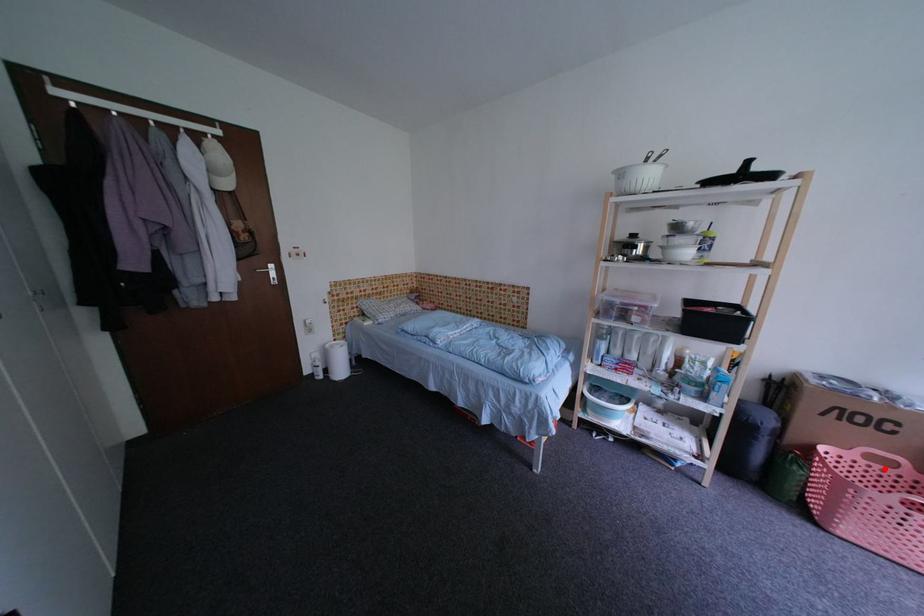
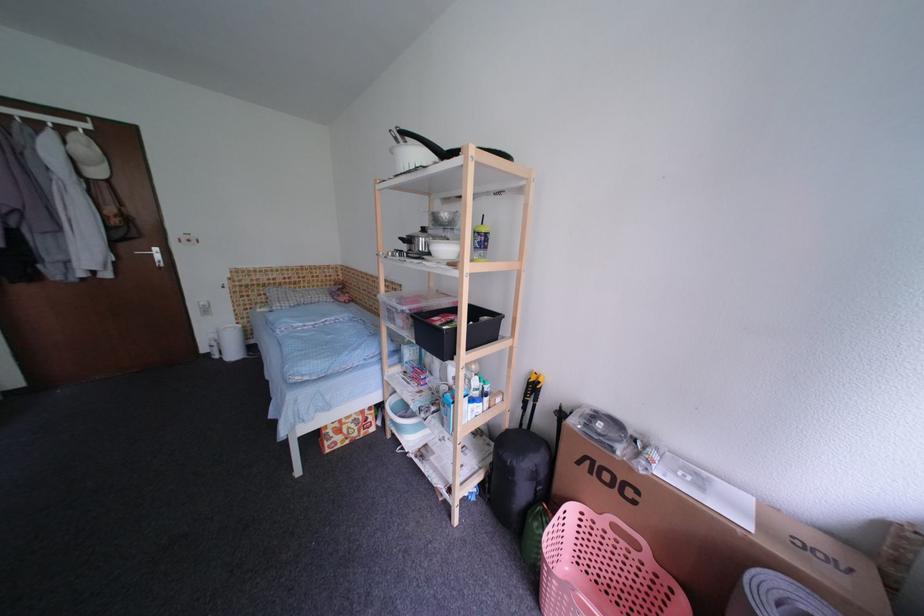
Locate, in the second image, the point that corresponds to the highlighted location in the first image.

(630, 546)